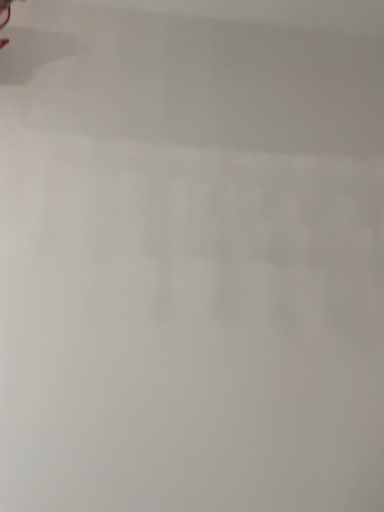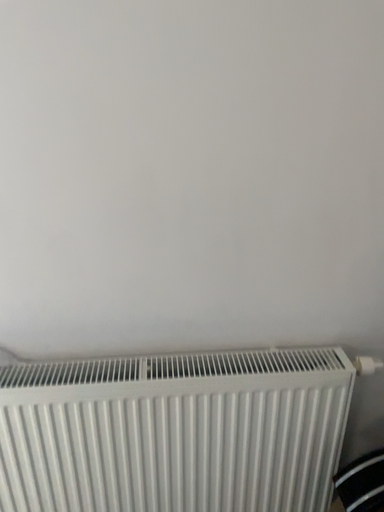
Question: How did the camera likely rotate when shooting the video?

Choices:
 (A) rotated upward
 (B) rotated downward

Answer: (B)